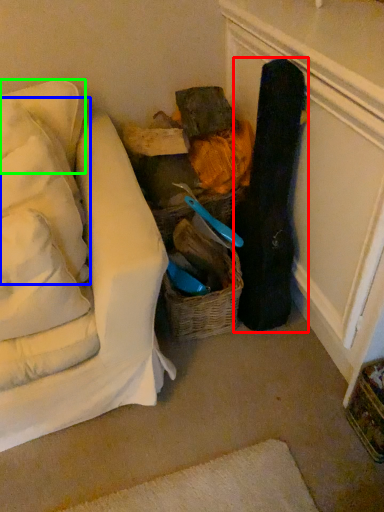
Question: Which is farther away from clothing (highlighted by a red box)? pillow (highlighted by a blue box) or pillow (highlighted by a green box)?

Choices:
 (A) pillow
 (B) pillow

Answer: (B)